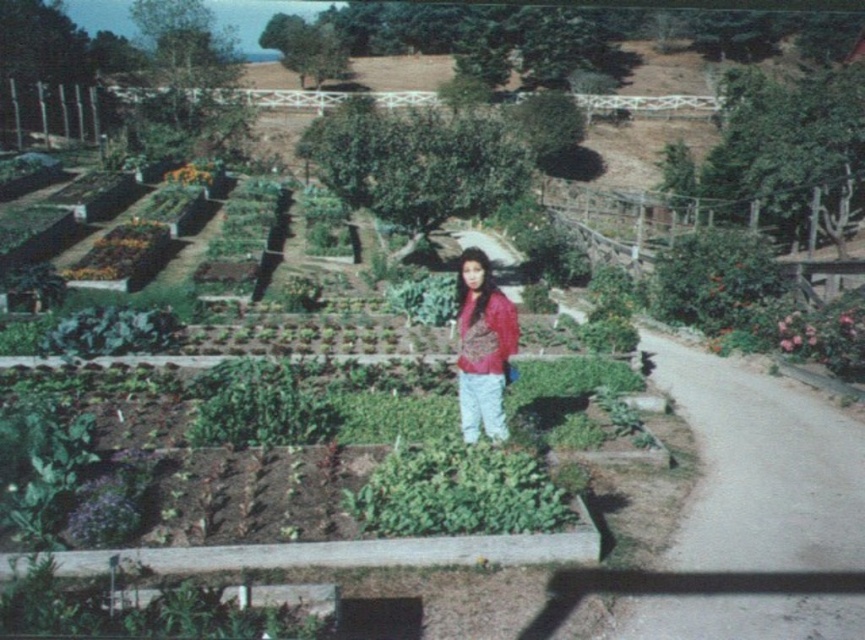
Question: Which of the following is the closest to the observer?

Choices:
 (A) (504, 417)
 (B) (432, 474)

Answer: (B)

Question: Which object is farther from the camera taking this photo?

Choices:
 (A) green leafy plant at center
 (B) matte pink blouse at center

Answer: (B)

Question: Is the position of green leafy plant at center more distant than that of matte pink blouse at center?

Choices:
 (A) yes
 (B) no

Answer: (B)

Question: Can you confirm if green leafy plant at center is positioned to the left of matte pink blouse at center?

Choices:
 (A) yes
 (B) no

Answer: (B)

Question: Can you confirm if green leafy plant at center is positioned above matte pink blouse at center?

Choices:
 (A) no
 (B) yes

Answer: (A)